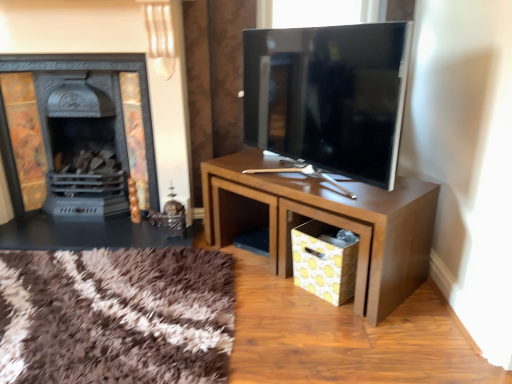
Where is `vacant area that lies between brown wood table at center and yellow paper drawer at lower right`? This screenshot has width=512, height=384. vacant area that lies between brown wood table at center and yellow paper drawer at lower right is located at coordinates point(286,287).